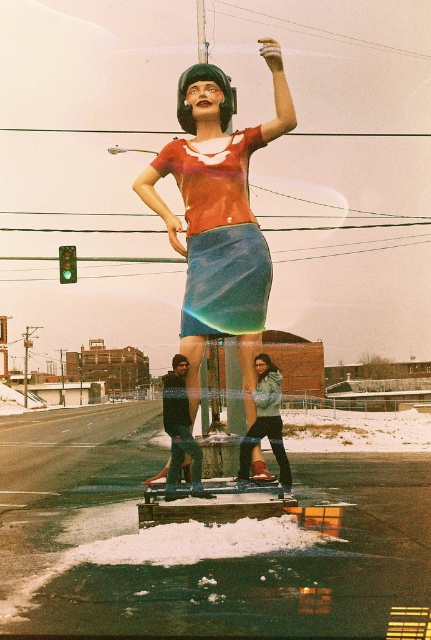
What do you see at coordinates (178, 426) in the screenshot?
I see `dark blue jeans at center` at bounding box center [178, 426].

The width and height of the screenshot is (431, 640). What are the coordinates of `dark blue jeans at center` in the screenshot? It's located at (178, 426).

Who is more distant from viewer, [175,403] or [265,364]?

The point [265,364] is more distant.

I want to click on dark blue jeans at center, so click(x=178, y=426).

Between matte red blouse at center and denim skirt at center, which one appears on the left side from the viewer's perspective?

Positioned to the left is matte red blouse at center.

Is point (203, 106) farther from viewer compared to point (253, 262)?

That is True.

Is point (189, 177) in front of point (158, 172)?

Yes, point (189, 177) is closer to viewer.

In order to click on matte red blouse at center in this screenshot , I will do `click(218, 216)`.

Which of these two, matte red blouse at center or light blue denim skirt at center, stands shorter?

light blue denim skirt at center

Where is `matte red blouse at center`? The width and height of the screenshot is (431, 640). matte red blouse at center is located at coordinates (218, 216).